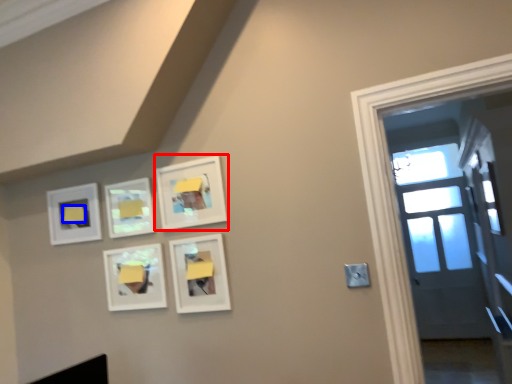
Question: Among these objects, which one is nearest to the camera, picture frame (highlighted by a red box) or lift (highlighted by a blue box)?

Choices:
 (A) picture frame
 (B) lift

Answer: (A)